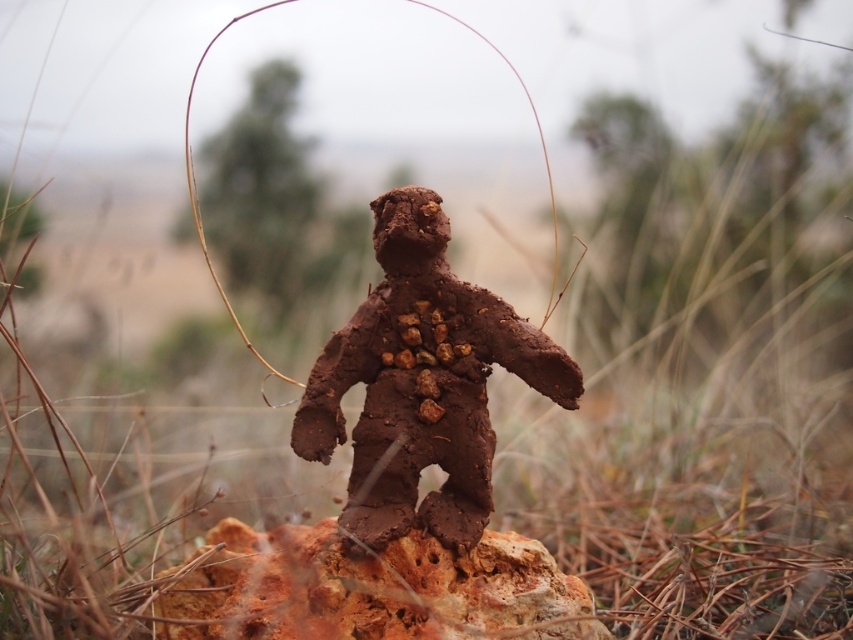
Does point (515, 352) come in front of point (264, 584)?

That is True.

Which is below, dull brown clay figure at center or rusty rock at center?

rusty rock at center is lower down.

This screenshot has height=640, width=853. What do you see at coordinates (421, 384) in the screenshot?
I see `dull brown clay figure at center` at bounding box center [421, 384].

At what (x,y) coordinates should I click in order to perform the action: click on dull brown clay figure at center. Please return your answer as a coordinate pair (x, y). This screenshot has width=853, height=640. Looking at the image, I should click on (421, 384).